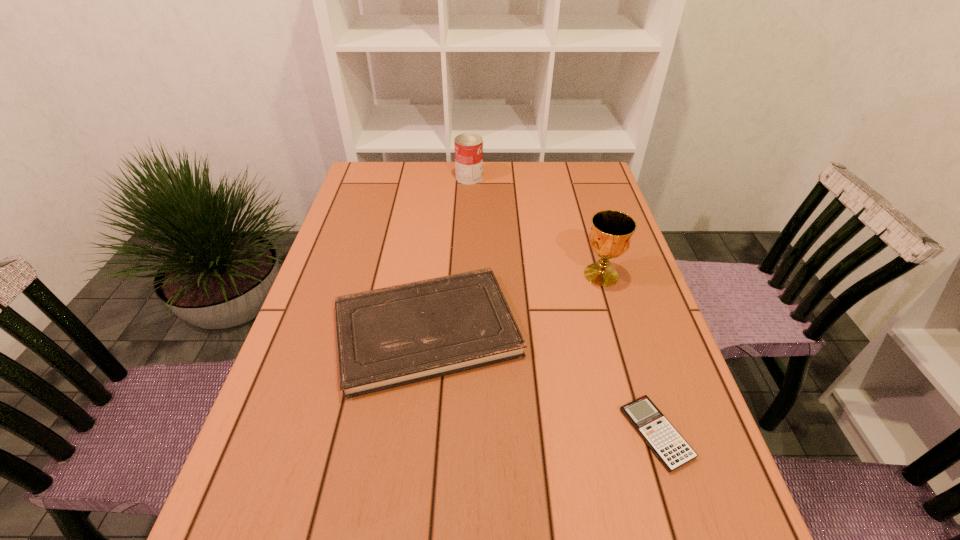
At what (x,y) coordinates should I click in order to perform the action: click on unoccupied area between the chalice and the paperback book. Please return your answer as a coordinate pair (x, y). Looking at the image, I should click on (514, 302).

Where is `free spot between the third tallest object and the tallest object`? free spot between the third tallest object and the tallest object is located at coordinates (514, 302).

The image size is (960, 540). I want to click on free space between the paperback book and the tallest object, so click(x=514, y=302).

Locate an element on the screen. vacant space that is in between the can and the tallest object is located at coordinates (536, 226).

Where is `free space between the shortest object and the tallest object`? The image size is (960, 540). free space between the shortest object and the tallest object is located at coordinates (629, 354).

The image size is (960, 540). Identify the location of vacant region between the can and the chalice. (536, 226).

Where is `empty space that is in between the shortest object and the second shortest object`? The image size is (960, 540). empty space that is in between the shortest object and the second shortest object is located at coordinates (541, 382).

At what (x,y) coordinates should I click in order to perform the action: click on vacant region between the farthest object and the tallest object. Please return your answer as a coordinate pair (x, y). The width and height of the screenshot is (960, 540). Looking at the image, I should click on (536, 226).

Select which object appears as the second closest to the second shortest object. Please provide its 2D coordinates. Your answer should be formatted as a tuple, i.e. [(x, y)], where the tuple contains the x and y coordinates of a point satisfying the conditions above.

[(667, 444)]

This screenshot has width=960, height=540. What are the coordinates of `the closest object to the farthest object` in the screenshot? It's located at (389, 337).